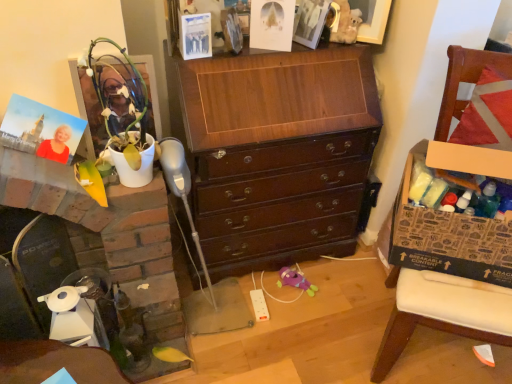
You are a GUI agent. You are given a task and a screenshot of the screen. Output one action in this format:
    pyautogui.click(x=<x>, y=<y>)
    Task: Click on the blank space to the left of brown wooden chair at right
    Image resolution: width=512 pixels, height=384 pixels.
    Given the screenshot: What is the action you would take?
    [306, 312]